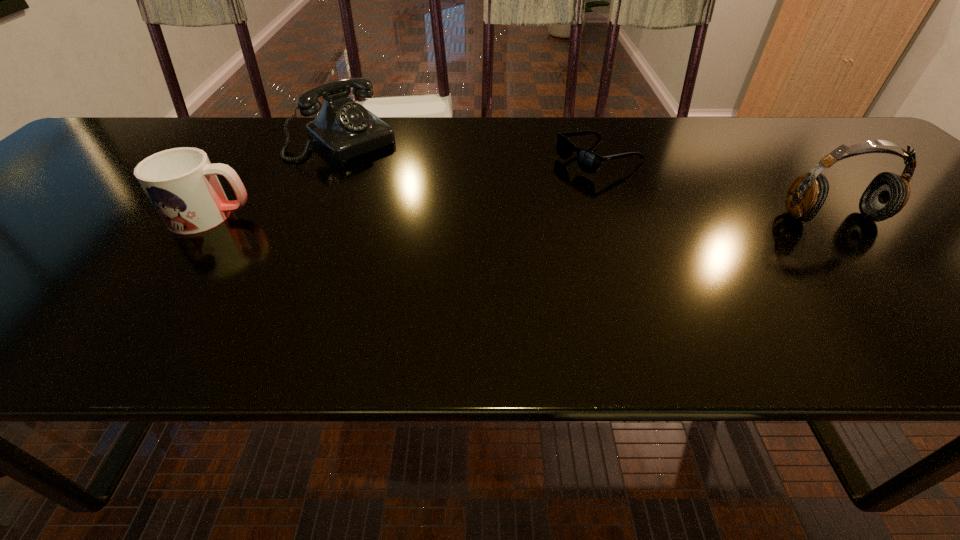
Where is `free space on the desktop that is between the mug and the headset and is positioned on the front-facing side of the sunglasses`? free space on the desktop that is between the mug and the headset and is positioned on the front-facing side of the sunglasses is located at coordinates (464, 216).

Where is `vacant spot on the desktop that is between the mug and the headset and is positioned on the dial of the telephone`? The width and height of the screenshot is (960, 540). vacant spot on the desktop that is between the mug and the headset and is positioned on the dial of the telephone is located at coordinates (436, 216).